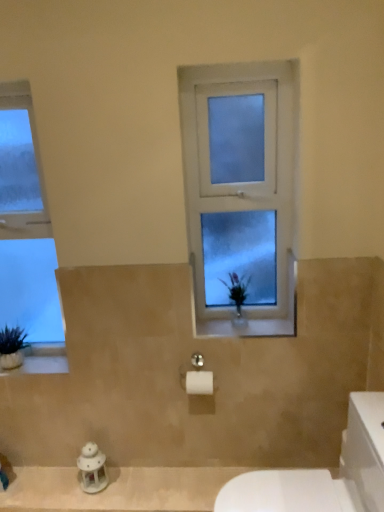
Question: Is white stone window sill at lower left aimed at frosted glass window at center, positioned as the first window in right-to-left order?

Choices:
 (A) no
 (B) yes

Answer: (A)

Question: Is white stone window sill at lower left oriented away from frosted glass window at center, positioned as the first window in right-to-left order?

Choices:
 (A) yes
 (B) no

Answer: (B)

Question: From the image's perspective, is white stone window sill at lower left located above frosted glass window at center, positioned as the first window in right-to-left order?

Choices:
 (A) yes
 (B) no

Answer: (B)

Question: Is white stone window sill at lower left to the left of frosted glass window at center, the 2th window from the left, from the viewer's perspective?

Choices:
 (A) no
 (B) yes

Answer: (B)

Question: Is white stone window sill at lower left closer to camera compared to frosted glass window at center, positioned as the first window in right-to-left order?

Choices:
 (A) yes
 (B) no

Answer: (B)

Question: From a real-world perspective, does white stone window sill at lower left sit lower than frosted glass window at center, the 2th window from the left?

Choices:
 (A) no
 (B) yes

Answer: (B)

Question: Is white stone window sill at lower left positioned far away from white porcelain lantern at lower left?

Choices:
 (A) yes
 (B) no

Answer: (B)

Question: Is white stone window sill at lower left in contact with white porcelain lantern at lower left?

Choices:
 (A) yes
 (B) no

Answer: (B)

Question: Is white stone window sill at lower left positioned beyond the bounds of white porcelain lantern at lower left?

Choices:
 (A) no
 (B) yes

Answer: (B)

Question: From the image's perspective, is white stone window sill at lower left beneath white porcelain lantern at lower left?

Choices:
 (A) no
 (B) yes

Answer: (A)

Question: Is white stone window sill at lower left wider than white porcelain lantern at lower left?

Choices:
 (A) yes
 (B) no

Answer: (A)

Question: From the image's perspective, is white stone window sill at lower left located above white porcelain lantern at lower left?

Choices:
 (A) yes
 (B) no

Answer: (A)

Question: Does white glossy porcelain at lower right turn towards clear glass window at left, the second window viewed from the right?

Choices:
 (A) yes
 (B) no

Answer: (B)